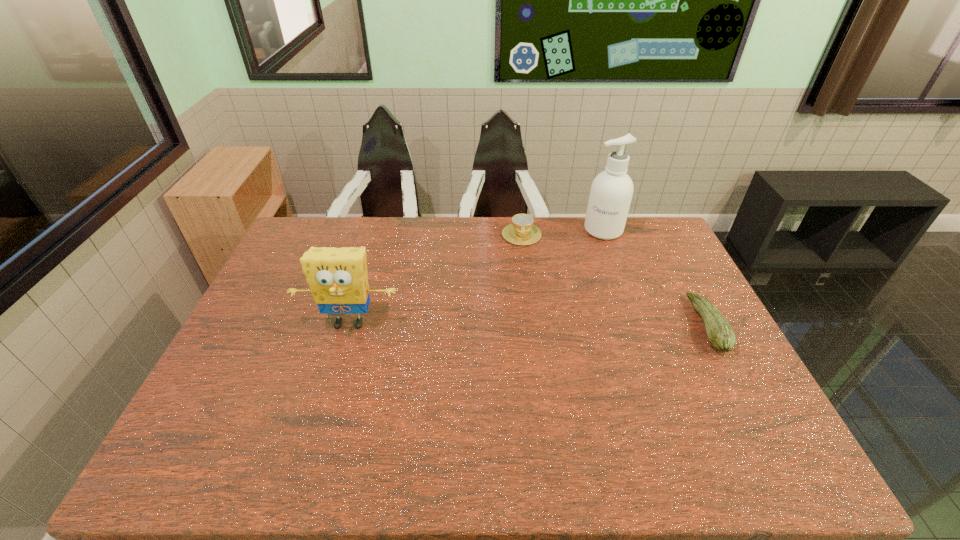
I want to click on sponge, so click(x=338, y=279).

Identify the location of the third shortest object. (338, 279).

Find the location of a particular element. the rightmost object is located at coordinates (720, 334).

Identify the location of the second object from left to right. (522, 231).

Locate an element on the screen. This screenshot has height=540, width=960. cleansing agent is located at coordinates (611, 192).

Where is `the third object from left to right`? The height and width of the screenshot is (540, 960). the third object from left to right is located at coordinates (611, 192).

The width and height of the screenshot is (960, 540). Identify the location of vacant space situated on the face of the leftmost object. (324, 408).

In order to click on blank space located at the stem end of the rightmost object in this screenshot , I will do `click(633, 325)`.

The height and width of the screenshot is (540, 960). I want to click on vacant space located 0.170m at the stem end of the rightmost object, so click(x=636, y=325).

Where is `vacant space located at the stem end of the rightmost object`? The height and width of the screenshot is (540, 960). vacant space located at the stem end of the rightmost object is located at coordinates (674, 325).